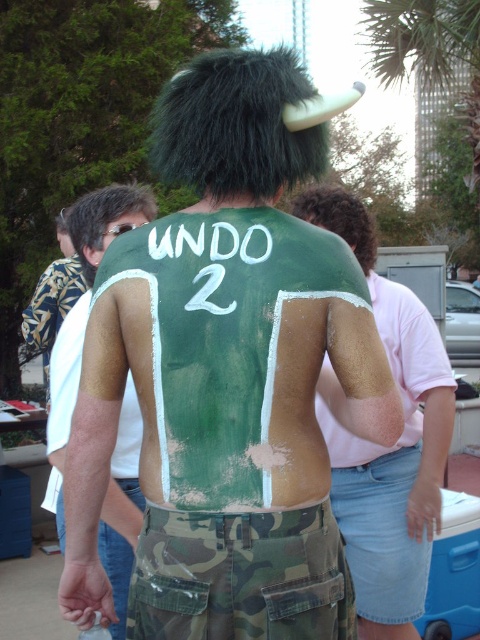
Question: Estimate the real-world distances between objects in this image. Which object is closer to the white chalk writing at center back?

Choices:
 (A) green matte paint at center
 (B) green matte body paint at center
 (C) white matte shirt at upper left
 (D) camouflagetextured fabric at lower center

Answer: (B)

Question: Which point appears farthest from the camera in this image?

Choices:
 (A) (347, 419)
 (B) (84, 330)

Answer: (B)

Question: In this image, where is green matte body paint at center located relative to matte gold shirt at upper right?

Choices:
 (A) below
 (B) above

Answer: (B)

Question: Which of the following is the farthest from the observer?

Choices:
 (A) green matte body paint at center
 (B) white chalk writing at center back

Answer: (B)

Question: Can you confirm if green matte paint at center is positioned to the right of matte gold shirt at upper right?

Choices:
 (A) no
 (B) yes

Answer: (B)

Question: Does white chalk writing at center back appear over matte gold shirt at upper right?

Choices:
 (A) yes
 (B) no

Answer: (A)